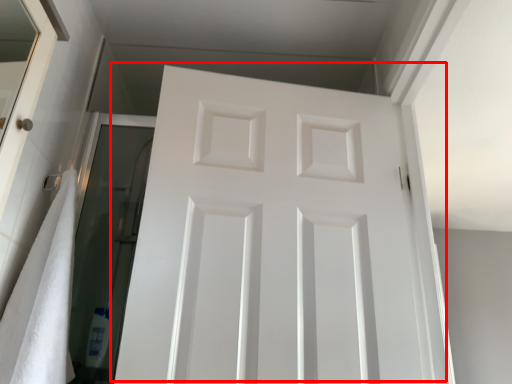
Question: From the image's perspective, where is door (annotated by the red box) located in relation to bath towel in the image?

Choices:
 (A) below
 (B) above

Answer: (B)